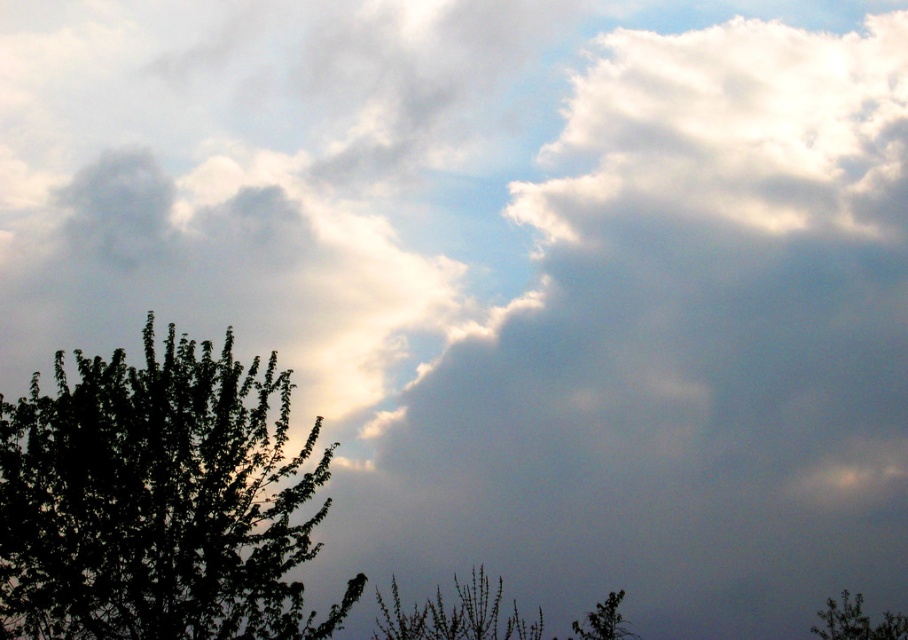
Question: Is green matte tree at lower center further to the viewer compared to green leafy tree at lower right?

Choices:
 (A) no
 (B) yes

Answer: (A)

Question: Which of the following is the closest to the observer?

Choices:
 (A) (607, 628)
 (B) (522, 634)
 (C) (832, 620)

Answer: (A)

Question: Among these points, which one is farthest from the camera?

Choices:
 (A) (622, 630)
 (B) (82, 406)
 (C) (860, 630)
 (D) (435, 596)

Answer: (B)

Question: Which point is closer to the camera?

Choices:
 (A) green matte tree at lower center
 (B) green matte tree at lower right

Answer: (A)

Question: Is green leafy tree at lower right below green matte tree at lower right?

Choices:
 (A) no
 (B) yes

Answer: (B)

Question: Is dark green leafy tree at lower left to the right of green leafy tree at lower right from the viewer's perspective?

Choices:
 (A) no
 (B) yes

Answer: (A)